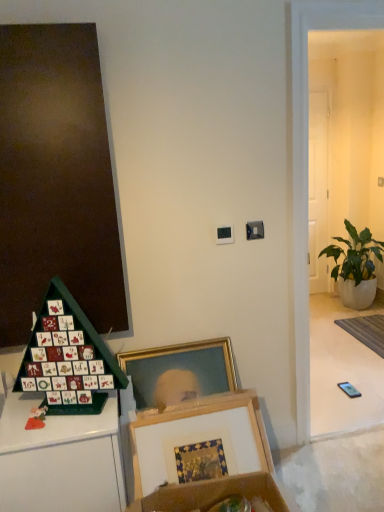
Find the location of `vacant space underneath green leafy plant in white pot at right (from a real-world perspective)`. vacant space underneath green leafy plant in white pot at right (from a real-world perspective) is located at coordinates (340, 308).